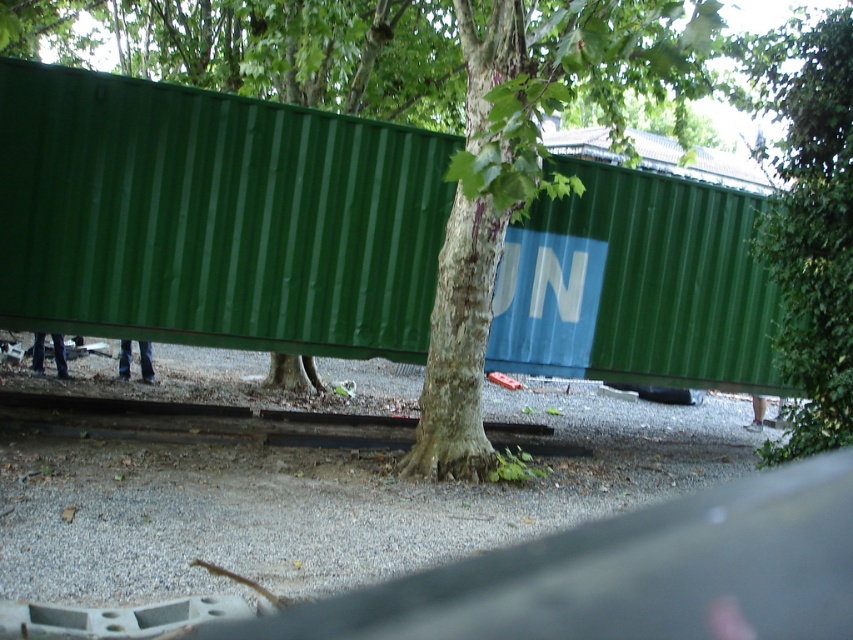
Question: Which point is closer to the camera?

Choices:
 (A) green corrugated metal at center
 (B) metallic gray train track at center
 (C) green corrugated metal shipping container at center

Answer: (A)

Question: Which point is closer to the camera?

Choices:
 (A) green corrugated metal at center
 (B) green corrugated metal shipping container at center
 (C) metallic gray train track at center

Answer: (A)

Question: In this image, where is green corrugated metal shipping container at center located relative to metallic gray train track at center?

Choices:
 (A) below
 (B) above

Answer: (B)

Question: Which object is the farthest from the metallic gray train track at center?

Choices:
 (A) green corrugated metal shipping container at center
 (B) green corrugated metal at center

Answer: (B)

Question: Where is green corrugated metal shipping container at center located in relation to metallic gray train track at center in the image?

Choices:
 (A) above
 (B) below

Answer: (A)

Question: Is green corrugated metal shipping container at center smaller than green corrugated metal at center?

Choices:
 (A) yes
 (B) no

Answer: (A)